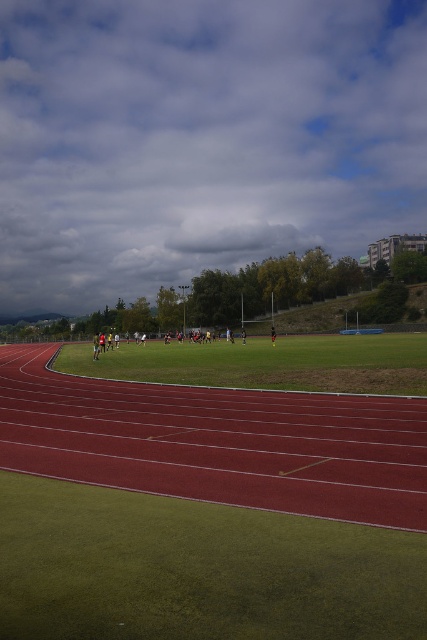
You are a spectator at the sports field and want to know which area is smaller between the green grass football field at center and the green grass field at center. Can you tell me?

The green grass football field at center has a smaller size compared to the green grass field at center.

You are a spectator at the sports field and want to take a photo of both the green grass football field at center and the green grass field at center. Which one should you focus on first if you want to capture both in one shot?

The green grass football field at center is to the left of green grass field at center, so you should focus on the one on the left first to ensure both are in frame.